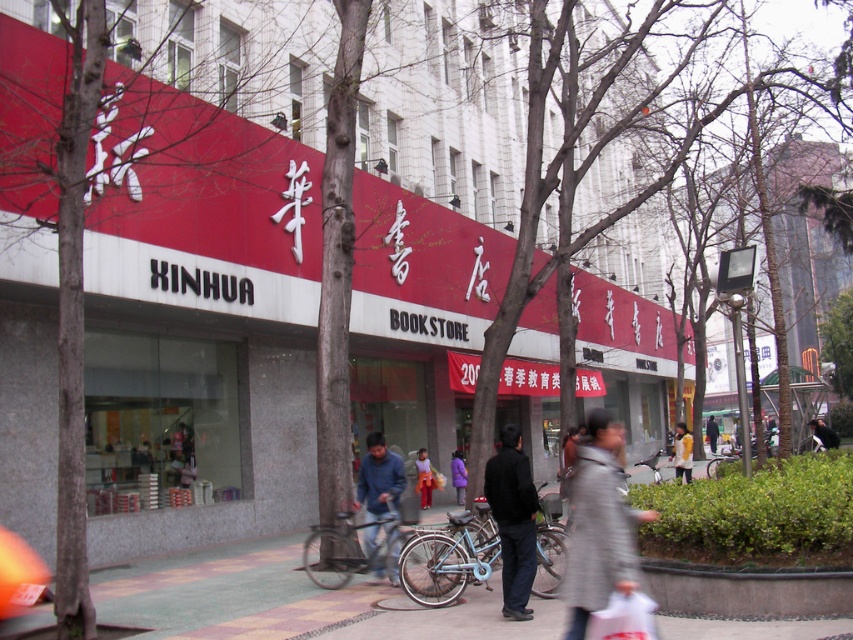
Between point (517, 516) and point (711, 422), which one is positioned in front?

Point (517, 516)

Which is above, dark blue jeans at center or dark blue jacket at center?

dark blue jeans at center

Is point (489, 483) behind point (711, 449)?

No, it is not.

This screenshot has width=853, height=640. I want to click on dark blue jeans at center, so click(x=514, y=518).

How distant is denim jacket at center from dark blue jacket at center?

denim jacket at center and dark blue jacket at center are 23.38 meters apart.

From the picture: Can you confirm if denim jacket at center is taller than dark blue jacket at center?

No.

Identify the location of denim jacket at center. (424, 477).

The image size is (853, 640). I want to click on denim jacket at center, so click(x=424, y=477).

Can you confirm if gray wool coat at center is wider than light gray jacket at center?

Yes, gray wool coat at center is wider than light gray jacket at center.

Find the location of a particular element. gray wool coat at center is located at coordinates tap(599, 525).